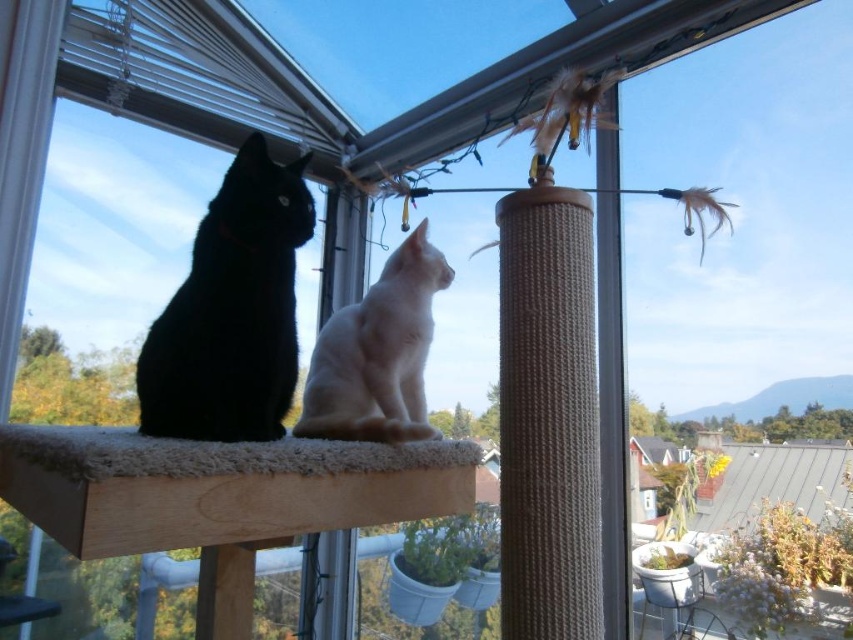
Question: Estimate the real-world distances between objects in this image. Which object is closer to the black matte cat at left?

Choices:
 (A) braided rope scratching post at center
 (B) white fur cat at center

Answer: (B)

Question: Which point is farther to the camera?

Choices:
 (A) (x=598, y=516)
 (B) (x=364, y=349)
 (C) (x=265, y=320)

Answer: (B)

Question: Where is braided rope scratching post at center located in relation to black matte cat at left in the image?

Choices:
 (A) below
 (B) above

Answer: (A)

Question: Observing the image, what is the correct spatial positioning of braided rope scratching post at center in reference to black matte cat at left?

Choices:
 (A) left
 (B) right

Answer: (B)

Question: Can you confirm if braided rope scratching post at center is bigger than black matte cat at left?

Choices:
 (A) no
 (B) yes

Answer: (A)

Question: Based on their relative distances, which object is farther from the white fur cat at center?

Choices:
 (A) black matte cat at left
 (B) braided rope scratching post at center

Answer: (B)